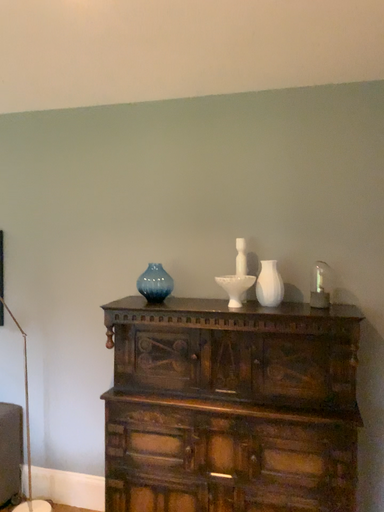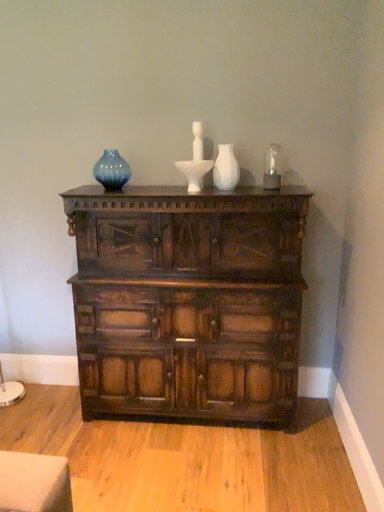
Question: How did the camera likely rotate when shooting the video?

Choices:
 (A) rotated right
 (B) rotated left

Answer: (A)